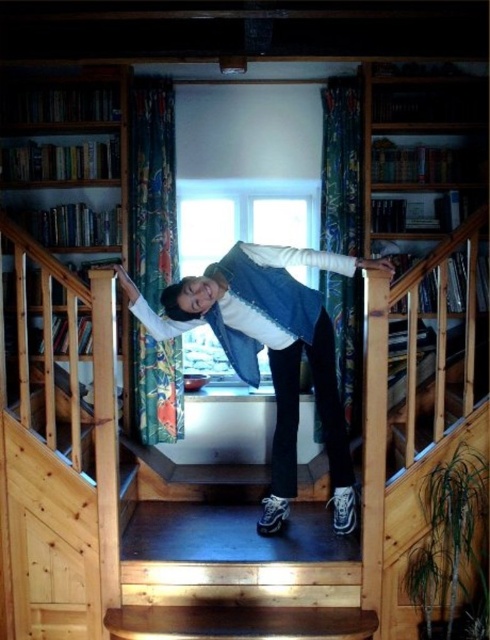
You are standing at the bottom of the stairs and want to hand a book to the person wearing the denim vest at center. Which direction should you walk to reach them first without passing the wooden bookshelf at left?

The denim vest at center is to the right of the wooden bookshelf at left, so you should walk to the right side of the stairs to reach the person without passing the wooden bookshelf at left.

Where is the denim vest at center located in the image?

The denim vest at center is located at point coordinates of (269, 352).